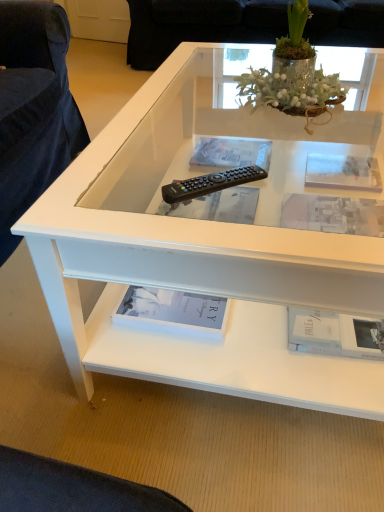
Where is `vacant area on top of white matte book at upper right, positioned as the third book in back-to-front order (from a real-world perspective)`? The width and height of the screenshot is (384, 512). vacant area on top of white matte book at upper right, positioned as the third book in back-to-front order (from a real-world perspective) is located at coordinates (330, 217).